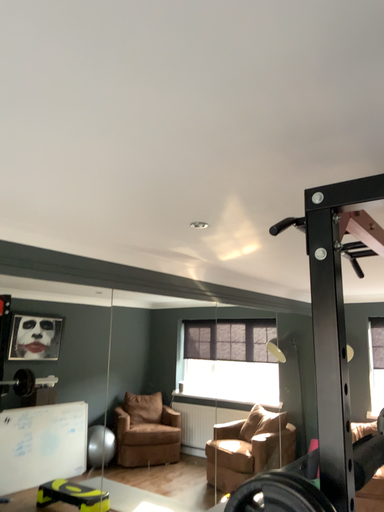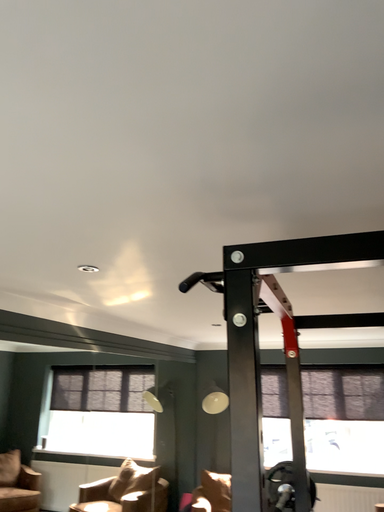
Question: How did the camera likely rotate when shooting the video?

Choices:
 (A) rotated right
 (B) rotated left

Answer: (A)